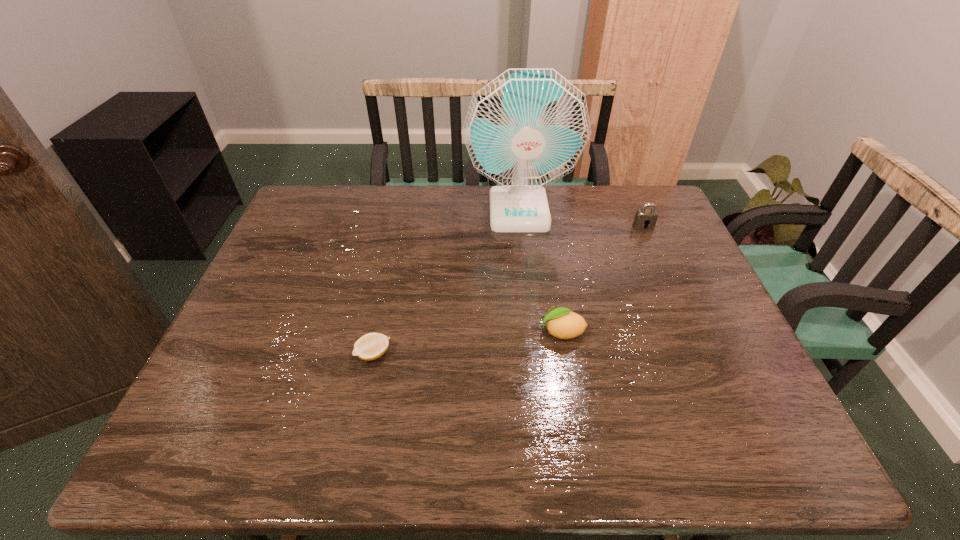
What are the coordinates of `empty space that is in between the taller lemon and the padlock` in the screenshot? It's located at (602, 279).

Point out which object is positioned as the nearest to the left lemon. Please provide its 2D coordinates. Your answer should be formatted as a tuple, i.e. [(x, y)], where the tuple contains the x and y coordinates of a point satisfying the conditions above.

[(562, 323)]

This screenshot has width=960, height=540. Find the location of `object that is the third closest to the rightmost object`. object that is the third closest to the rightmost object is located at coordinates (371, 346).

In order to click on vacant position in the image that satisfies the following two spatial constraints: 1. at the front of the padlock near the keyhole; 2. with leaves positioned above the right lemon in this screenshot , I will do `click(688, 332)`.

Find the location of a particular element. blank space that satisfies the following two spatial constraints: 1. at the front of the rightmost object near the keyhole; 2. with leaves positioned above the right lemon is located at coordinates [x=688, y=332].